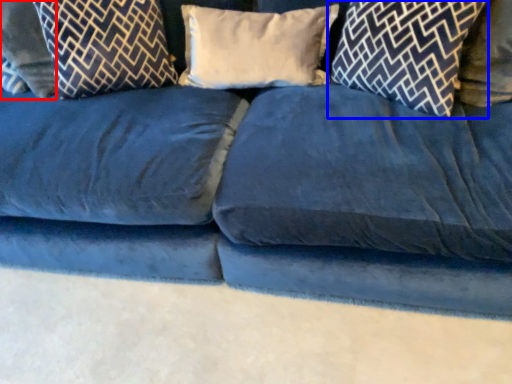
Question: Which point is closer to the camera, pillow (highlighted by a red box) or pillow (highlighted by a blue box)?

Choices:
 (A) pillow
 (B) pillow

Answer: (B)